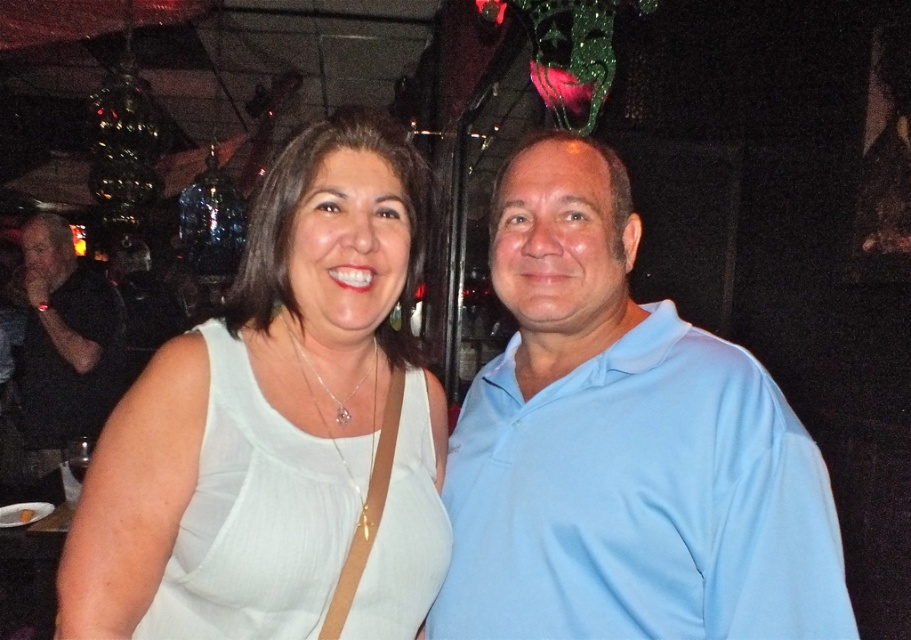
You are a photographer at a party and need to adjust the camera focus. The light blue cotton shirt at center and the black shirt at left are both in the frame. Which shirt should you focus on first if you want to ensure the taller one is in focus?

The black shirt at left is taller than the light blue cotton shirt at center, so you should focus on the black shirt at left first to ensure it is in focus.

From the picture: You are a photographer at a party and want to take a group photo. You notice the light blue cotton shirt at center and the white fabric dress at center. Which clothing item is blocking the view of the other?

The light blue cotton shirt at center is in front of the white fabric dress at center, so it is blocking the view of the white fabric dress at center.